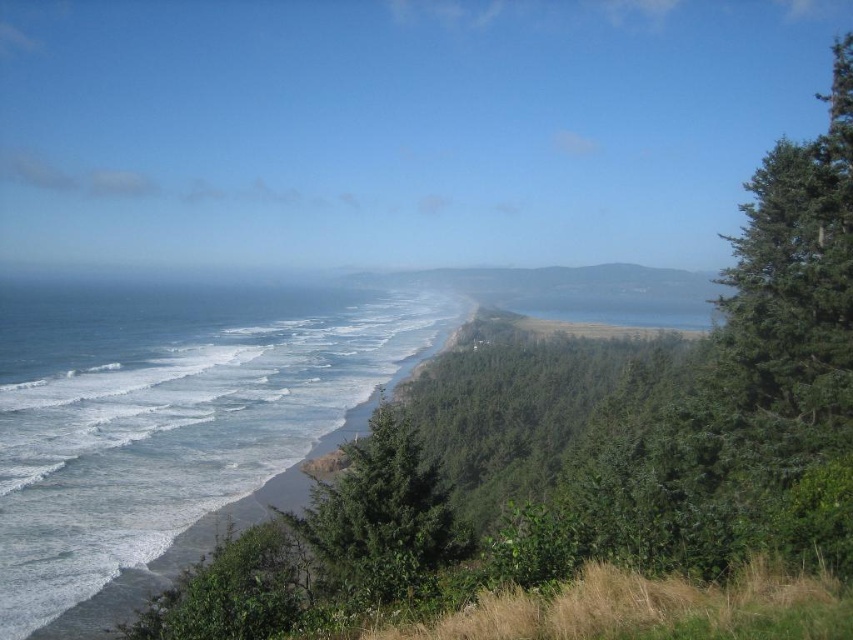
You are standing on the beach and see the blue water at lower left and the green leafy tree at center. Which object is positioned to the left of the other?

The blue water at lower left is to the left of the green leafy tree at center.